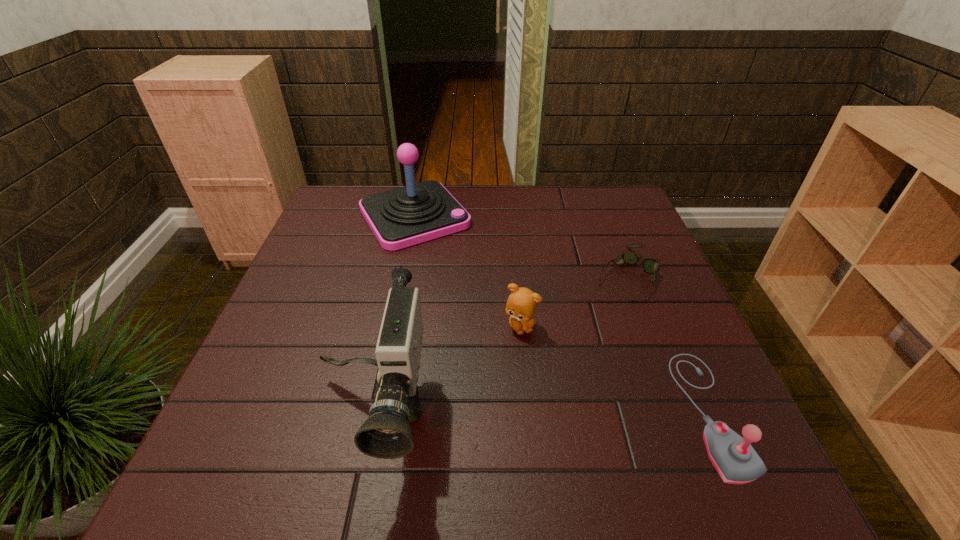
Image resolution: width=960 pixels, height=540 pixels. In order to click on camcorder that is at the near edge in this screenshot , I will do `click(386, 434)`.

At what (x,y) coordinates should I click in order to perform the action: click on joystick present at the near edge. Please return your answer as a coordinate pair (x, y). The height and width of the screenshot is (540, 960). Looking at the image, I should click on (733, 457).

At what (x,y) coordinates should I click in order to perform the action: click on object that is at the left edge. Please return your answer as a coordinate pair (x, y). Looking at the image, I should click on (402, 217).

I want to click on joystick that is at the right edge, so click(x=733, y=457).

The width and height of the screenshot is (960, 540). Identify the location of spectacles located at the right edge. (650, 265).

At what (x,y) coordinates should I click in order to perform the action: click on object at the far left corner. Please return your answer as a coordinate pair (x, y). Looking at the image, I should click on (402, 217).

Image resolution: width=960 pixels, height=540 pixels. I want to click on object that is at the near right corner, so click(733, 457).

The image size is (960, 540). Find the location of `vacant space at the far edge of the desktop`. vacant space at the far edge of the desktop is located at coordinates (470, 199).

In the image, there is a desktop. Where is `vacant space at the near edge`? Image resolution: width=960 pixels, height=540 pixels. vacant space at the near edge is located at coordinates (516, 404).

Find the location of a particular element. The width and height of the screenshot is (960, 540). vacant space at the left edge is located at coordinates (303, 303).